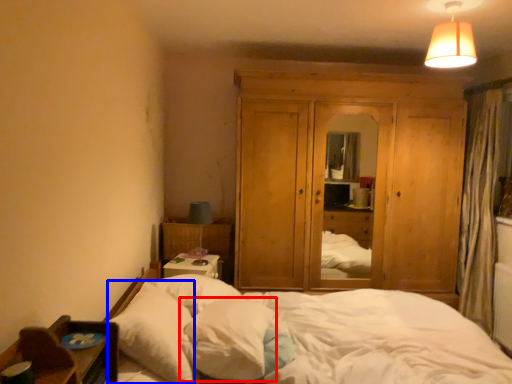
Question: Which point is closer to the camera, pillow (highlighted by a red box) or pillow (highlighted by a blue box)?

Choices:
 (A) pillow
 (B) pillow

Answer: (B)